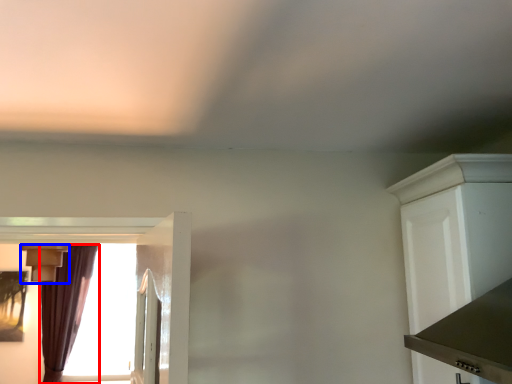
Question: Which object appears closest to the camera in this image, curtain (highlighted by a red box) or light fixture (highlighted by a blue box)?

Choices:
 (A) curtain
 (B) light fixture

Answer: (B)